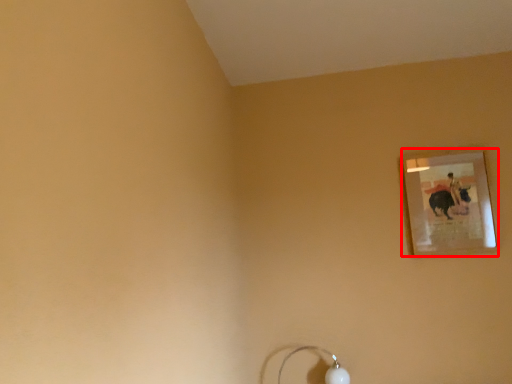
Question: Observing the image, what is the correct spatial positioning of picture frame (annotated by the red box) in reference to lamp?

Choices:
 (A) left
 (B) right

Answer: (B)